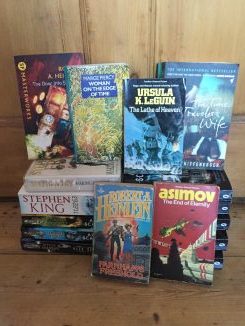
In order to click on wooden table in this screenshot , I will do `click(240, 221)`, `click(237, 271)`, `click(210, 306)`, `click(157, 306)`, `click(88, 297)`, `click(58, 266)`, `click(10, 230)`, `click(10, 272)`, `click(37, 300)`.